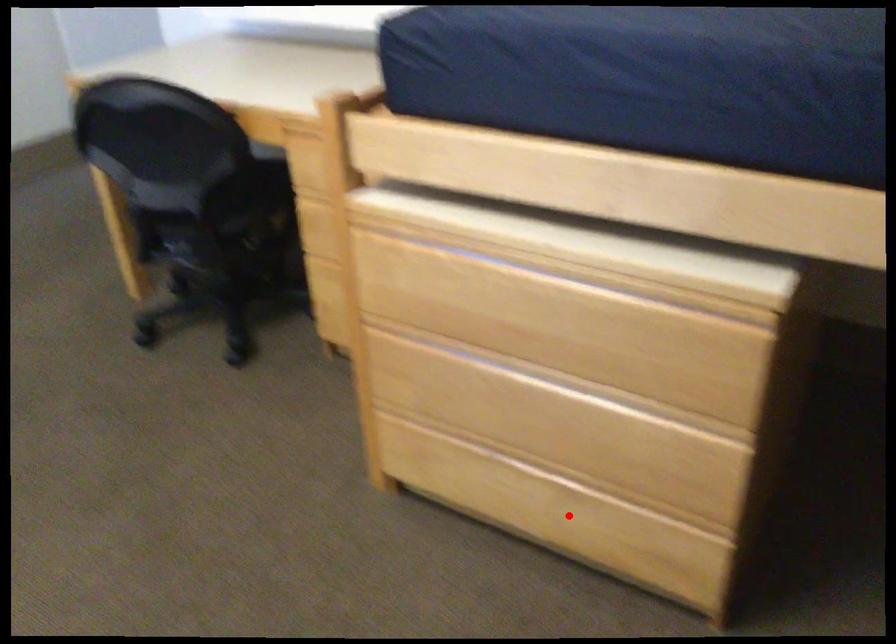
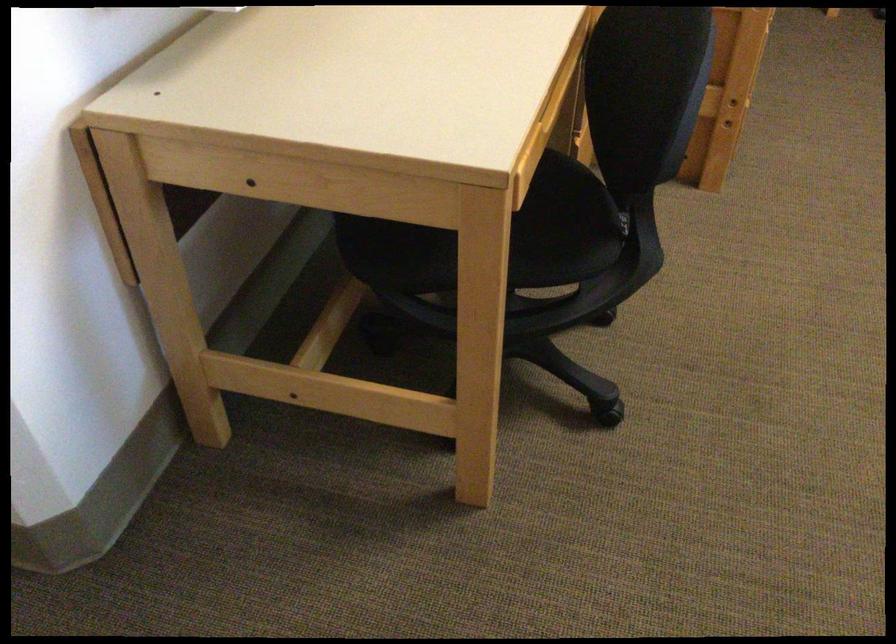
Question: I am providing you with two images of the same scene from different viewpoints. A red point is marked on the first image. Is the red point's position out of view in image 2?

Choices:
 (A) Yes
 (B) No

Answer: (A)